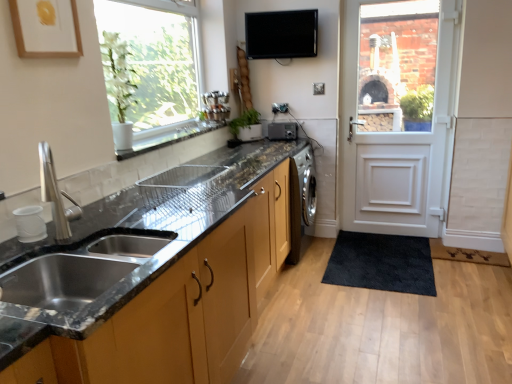
Question: Does white ceramic window sill at upper center have a greater width compared to green matte plant at center?

Choices:
 (A) no
 (B) yes

Answer: (B)

Question: Does white ceramic window sill at upper center appear on the right side of green matte plant at center?

Choices:
 (A) yes
 (B) no

Answer: (B)

Question: Is white ceramic window sill at upper center bigger than green matte plant at center?

Choices:
 (A) no
 (B) yes

Answer: (A)

Question: Does white ceramic window sill at upper center have a greater height compared to green matte plant at center?

Choices:
 (A) no
 (B) yes

Answer: (A)

Question: Are white ceramic window sill at upper center and green matte plant at center making contact?

Choices:
 (A) yes
 (B) no

Answer: (B)

Question: In terms of width, does matte black sink at lower left, which is counted as the 1th cabinetry, starting from the top, look wider or thinner when compared to matte brown cabinets at lower left, acting as the first cabinetry starting from the bottom?

Choices:
 (A) wide
 (B) thin

Answer: (B)

Question: Looking at the image, does matte black sink at lower left, which is counted as the 1th cabinetry, starting from the top, seem bigger or smaller compared to matte brown cabinets at lower left, acting as the first cabinetry starting from the bottom?

Choices:
 (A) big
 (B) small

Answer: (B)

Question: From a real-world perspective, is matte black sink at lower left, which is counted as the 1th cabinetry, starting from the top, above or below matte brown cabinets at lower left, acting as the first cabinetry starting from the bottom?

Choices:
 (A) below
 (B) above

Answer: (B)

Question: From the image's perspective, is matte black sink at lower left, arranged as the second cabinetry when ordered from the bottom, located above or below matte brown cabinets at lower left, acting as the first cabinetry starting from the bottom?

Choices:
 (A) above
 (B) below

Answer: (A)

Question: Is matte brown cabinets at lower left, which appears as the second cabinetry when viewed from the top, bigger or smaller than white ceramic window sill at upper center?

Choices:
 (A) big
 (B) small

Answer: (A)

Question: Is matte brown cabinets at lower left, acting as the first cabinetry starting from the bottom, in front of or behind white ceramic window sill at upper center in the image?

Choices:
 (A) behind
 (B) front

Answer: (B)

Question: Visually, is matte brown cabinets at lower left, which appears as the second cabinetry when viewed from the top, positioned to the left or to the right of white ceramic window sill at upper center?

Choices:
 (A) right
 (B) left

Answer: (A)

Question: Looking at their shapes, would you say matte brown cabinets at lower left, which appears as the second cabinetry when viewed from the top, is wider or thinner than white ceramic window sill at upper center?

Choices:
 (A) thin
 (B) wide

Answer: (B)

Question: In the image, is black glossy tv at upper center, which is counted as the 1th appliance, starting from the front, positioned in front of or behind matte brown cabinets at lower left, which appears as the second cabinetry when viewed from the top?

Choices:
 (A) behind
 (B) front

Answer: (A)

Question: Choose the correct answer: Is black glossy tv at upper center, which is counted as the 2th appliance, starting from the bottom, inside matte brown cabinets at lower left, which appears as the second cabinetry when viewed from the top, or outside it?

Choices:
 (A) outside
 (B) inside

Answer: (A)